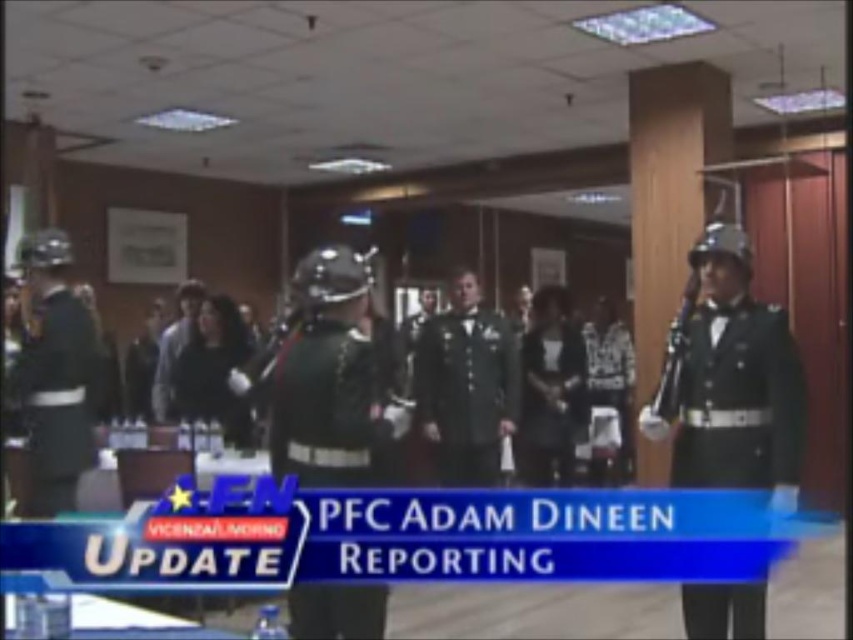
Question: Can you confirm if matte black uniform at center is thinner than shiny black uniform at center?

Choices:
 (A) no
 (B) yes

Answer: (A)

Question: Which point appears closest to the camera in this image?

Choices:
 (A) (161, 392)
 (B) (347, 481)

Answer: (B)

Question: Does matte black uniform at center have a lesser width compared to shiny black uniform at center?

Choices:
 (A) no
 (B) yes

Answer: (A)

Question: Among these points, which one is nearest to the camera?

Choices:
 (A) (618, 320)
 (B) (318, 346)
 (C) (751, 304)

Answer: (B)

Question: Among these points, which one is farthest from the camera?

Choices:
 (A) (177, 385)
 (B) (38, 474)
 (C) (770, 336)

Answer: (A)

Question: Considering the relative positions of black glossy uniform at center and dark green fabric uniform at center in the image provided, where is black glossy uniform at center located with respect to dark green fabric uniform at center?

Choices:
 (A) right
 (B) left

Answer: (A)